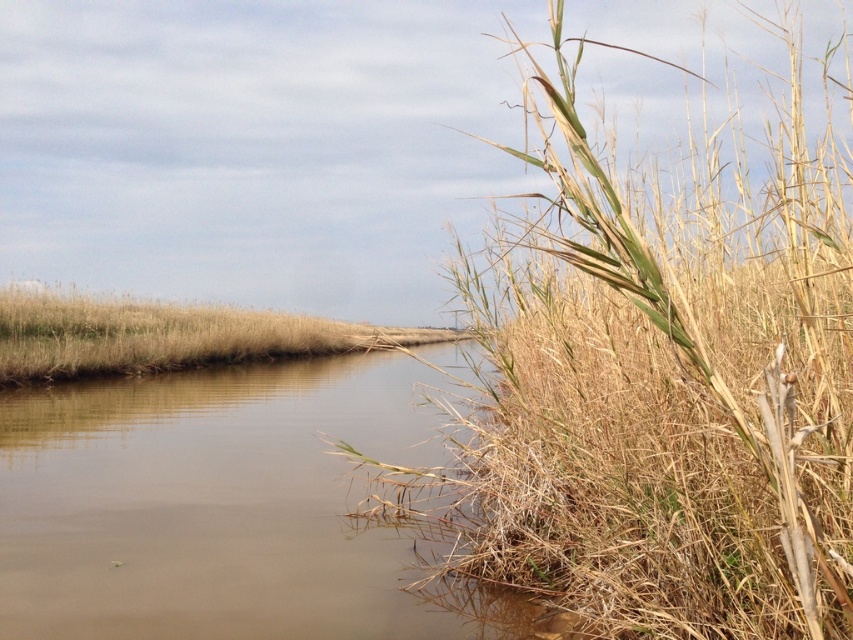
You are a small boat operator navigating a narrow waterway. You need to pass between the brown muddy water at center and dry grass at center. The boat is 20 feet long. Can you safely navigate through the space between them?

The space between the brown muddy water at center and dry grass at center is 20.35 feet. Since the boat is 20 feet long, it can safely pass through the space as it is slightly wider than the boat.